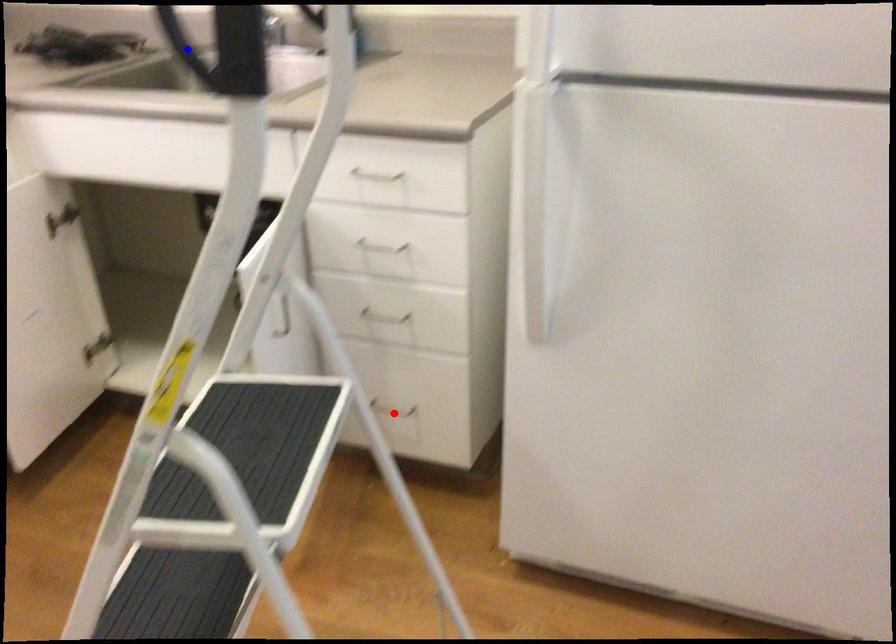
Question: Two points are marked on the image. Which point is closer to the camera?

Choices:
 (A) Blue point is closer.
 (B) Red point is closer.

Answer: (A)